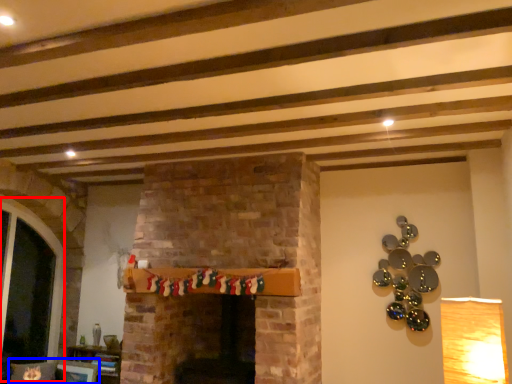
Question: Which of the following is the closest to the observer, glass door (highlighted by a red box) or chair (highlighted by a blue box)?

Choices:
 (A) glass door
 (B) chair

Answer: (B)